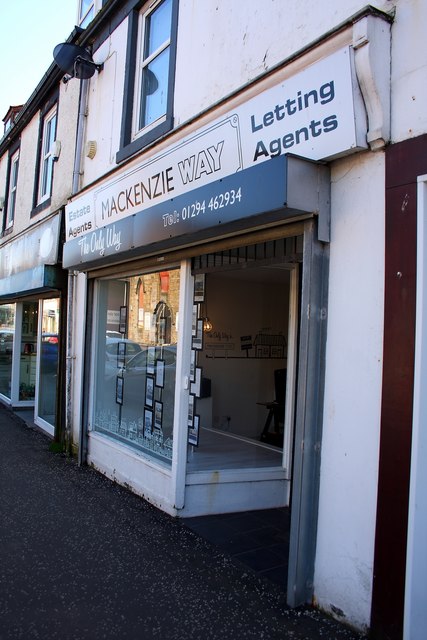
Locate an element on the screen. This screenshot has width=427, height=640. black tile is located at coordinates (222, 532).